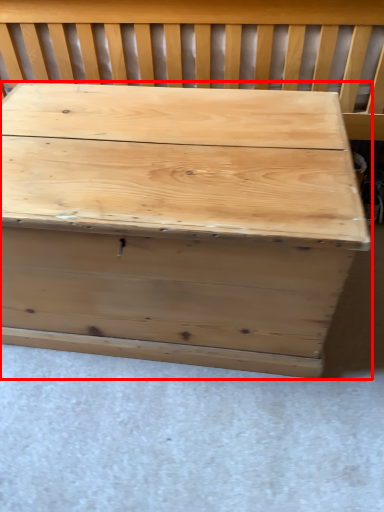
Question: From the image's perspective, where is table (annotated by the red box) located relative to church bench?

Choices:
 (A) above
 (B) below

Answer: (B)